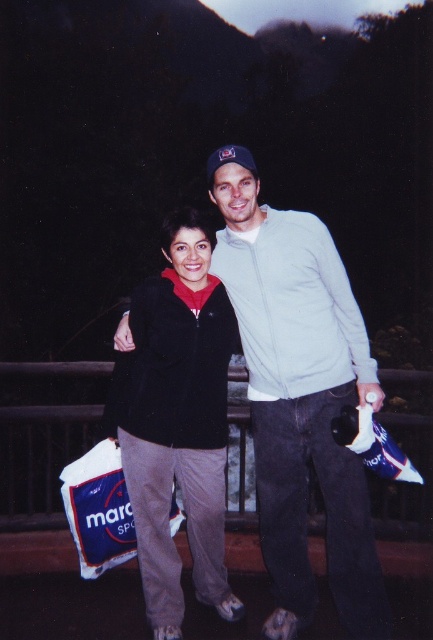
In the scene shown: You are taking a photo of two people in a dark park at night. You notice two points in the image labeled as point (229, 257) and point (129, 493). Which of these points is closer to the camera?

Point (229, 257) is closer to the camera than point (129, 493) because it is further to the camera than the other point.

You are trying to decide which jacket to wear for a night walk in a park. The light gray cotton jacket at center and the black fleece jacket at center are both options. Based on their sizes, which one might be more comfortable for layering over other clothes?

The light gray cotton jacket at center has a larger width than the black fleece jacket at center, so it might be more comfortable for layering over other clothes due to its wider design.